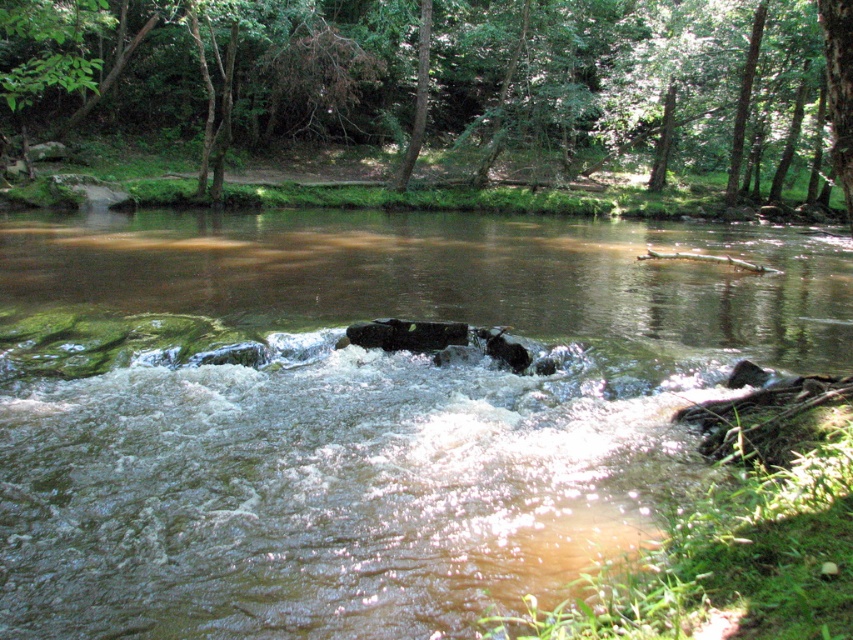
Based on the photo, you are a hiker who wants to cross the river using the shallow areas. The green leafy tree at upper center and the green rough bark tree at upper center are both on the same bank. Which tree is closer to the other bank?

The green leafy tree at upper center is 31.74 feet from green rough bark tree at upper center. Since both are on the same bank, their distance from the other bank would depend on their position along the bank. However, the description only provides their distance from each other, not their distance from the riverbanks. Therefore, it is impossible to determine which is closer to the other bank based on the given information.

You are a hiker carrying a heavy backpack and want to cross the river. You notice the brown smooth rock at center and the green rough bark tree at upper center. Which object can provide a more stable footing for crossing the river?

The brown smooth rock at center is bigger than the green rough bark tree at upper center, so it can provide a more stable footing for crossing the river.

You are standing at the center of the river and want to reach the green leafy tree at upper center. Which direction should you head towards?

The green leafy tree at upper center is located at point (x=445, y=77), so you should head towards the upper center direction to reach it.